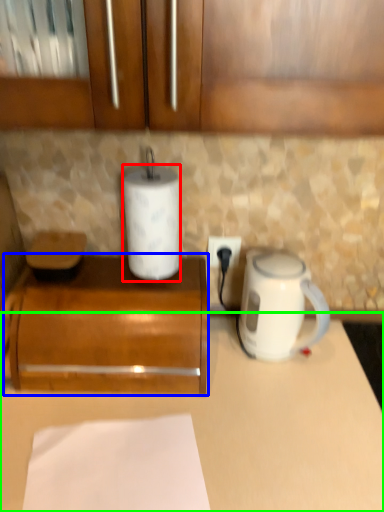
Question: Based on their relative distances, which object is nearer to paper towel (highlighted by a red box)? Choose from cabinetry (highlighted by a blue box) and counter (highlighted by a green box).

Choices:
 (A) cabinetry
 (B) counter

Answer: (A)